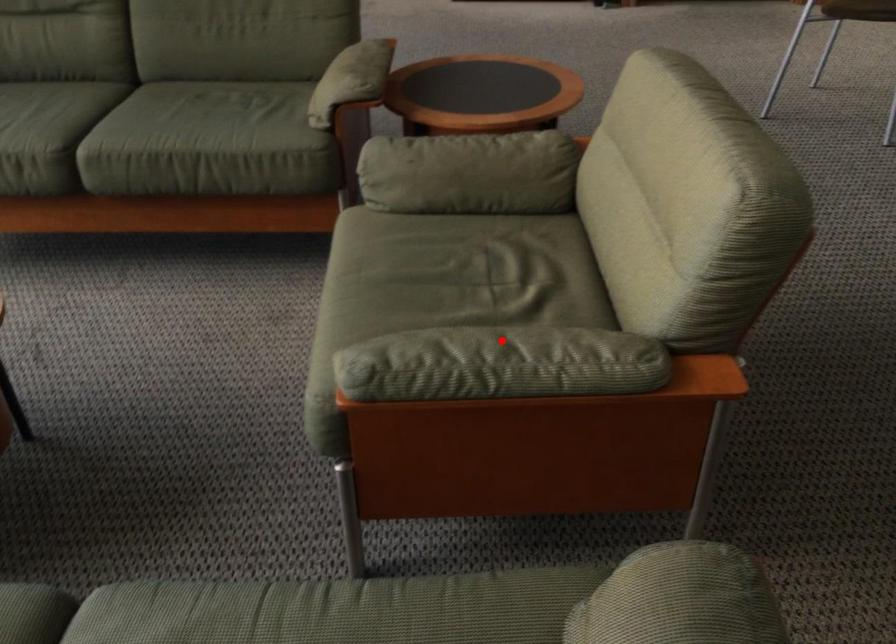
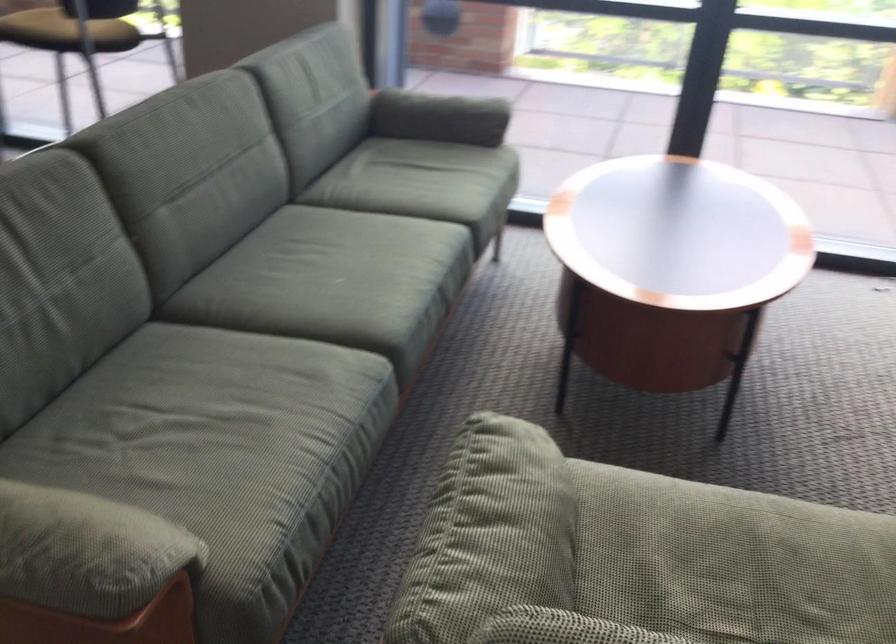
Where in the second image is the point corresponding to the highlighted location from the first image?

(500, 527)